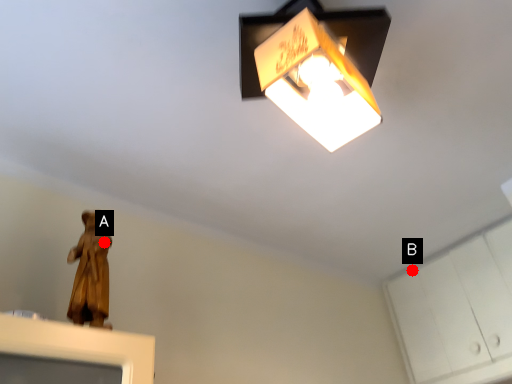
Question: Two points are circled on the image, labeled by A and B beside each circle. Which point is closer to the camera?

Choices:
 (A) A is closer
 (B) B is closer

Answer: (A)